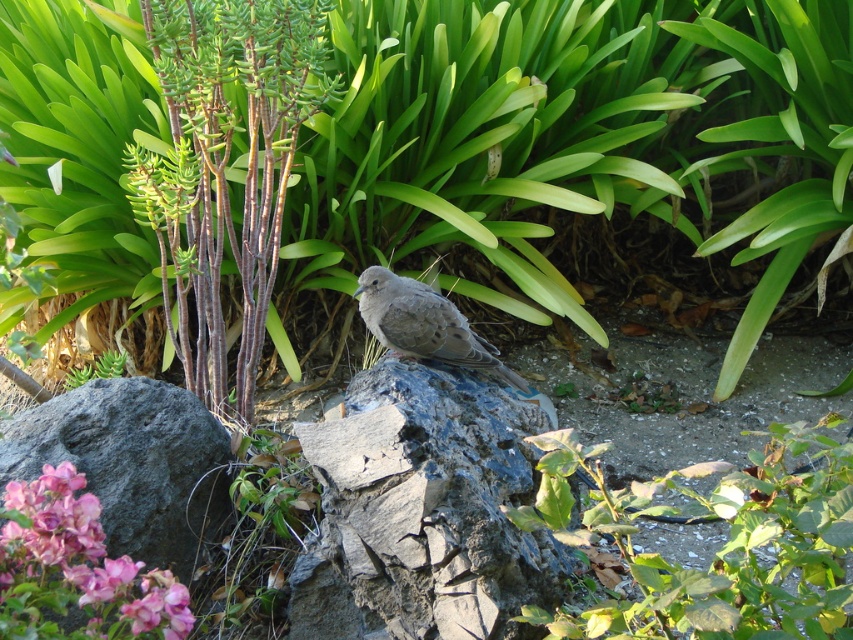
From the picture: You are standing in the outdoor area and want to observe the green leafy plant at center without moving your feet. Can you see the entire plant from your current position?

The green leafy plant at center is 4.76 feet away from the viewer, so yes, you can see the entire plant from your current position since it is within a reasonable viewing distance.

You are standing at the point marked as point (720,548). What do you see directly in front of you?

At point (720,548) lies green leafy plant at center.

You are a photographer trying to capture a closeup shot of the brown feathered bird at center. You want to ensure the gray rough rock at center is fully visible in the background. Based on their sizes, is this possible?

The gray rough rock at center might be wider than brown feathered bird at center, so it is possible to have the bird in focus while the rock remains fully visible in the background as the rock is wider and can occupy more of the background space.